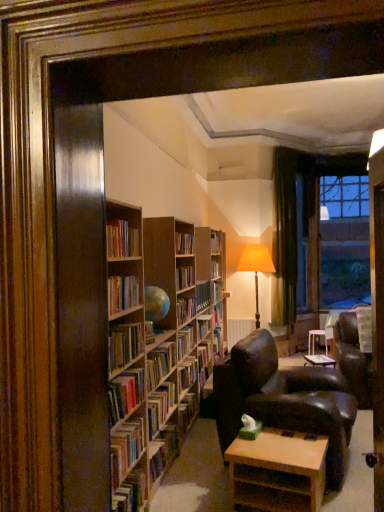
Image resolution: width=384 pixels, height=512 pixels. I want to click on hardcover books at center, the second book ordered from the bottom, so click(160, 406).

The height and width of the screenshot is (512, 384). In order to click on wooden bookshelf at center, placed as the 4th book when sorted from bottom to top in this screenshot , I will do `click(122, 293)`.

You are a GUI agent. You are given a task and a screenshot of the screen. Output one action in this format:
    pyautogui.click(x=<x>, y=<y>)
    Task: Click on the hardcover books at center, the third book positioned from the bottom
    This screenshot has width=384, height=512.
    Given the screenshot: What is the action you would take?
    pyautogui.click(x=160, y=362)

Locate an element on the screen. wooden bookcase at left is located at coordinates (155, 347).

Find the location of a particular element. The height and width of the screenshot is (512, 384). transparent glass door at upper right is located at coordinates pyautogui.click(x=305, y=239).

Based on the photo, from the image's perspective, does transparent glass door at upper right appear higher than clear glass window at upper right?

No, from the image's perspective, transparent glass door at upper right is not above clear glass window at upper right.

From a real-world perspective, is transparent glass door at upper right over clear glass window at upper right?

Actually, transparent glass door at upper right is physically below clear glass window at upper right in the real world.

Considering the positions of objects transparent glass door at upper right and clear glass window at upper right in the image provided, who is more to the left, transparent glass door at upper right or clear glass window at upper right?

transparent glass door at upper right.

Is point (259, 339) closer or farther from the camera than point (180, 252)?

Point (259, 339) is farther from the camera than point (180, 252).

Considering the relative sizes of leather armchair at center and wooden bookcase at left in the image provided, is leather armchair at center wider than wooden bookcase at left?

Yes.

From the image's perspective, which is above, leather armchair at center or wooden bookcase at left?

wooden bookcase at left, from the image's perspective.

Is leather armchair at center not close to wooden bookcase at left?

No, leather armchair at center is not far away from wooden bookcase at left.

Is matte orange shade at center located outside transparent glass door at upper right?

Yes.

Is matte orange shade at center bigger than transparent glass door at upper right?

Yes, matte orange shade at center is bigger than transparent glass door at upper right.

Which point is more forward, (250, 245) or (312, 302)?

Positioned in front is point (312, 302).

From the image's perspective, is matte orange shade at center below transparent glass door at upper right?

Yes, from the image's perspective, matte orange shade at center is below transparent glass door at upper right.

Is point (274, 482) behind point (135, 279)?

Yes, point (274, 482) is behind point (135, 279).

Is light brown wooden table at lower center oriented away from wooden bookshelf at center, placed as the 4th book when sorted from bottom to top?

No, light brown wooden table at lower center's orientation is not away from wooden bookshelf at center, placed as the 4th book when sorted from bottom to top.

Considering the sizes of objects light brown wooden table at lower center and wooden bookshelf at center, placed as the 4th book when sorted from bottom to top, in the image provided, who is thinner, light brown wooden table at lower center or wooden bookshelf at center, placed as the 4th book when sorted from bottom to top,?

With smaller width is wooden bookshelf at center, placed as the 4th book when sorted from bottom to top.

Does matte orange shade at center touch wooden bookcase at left?

No, matte orange shade at center is not with wooden bookcase at left.

Is matte orange shade at center facing towards wooden bookcase at left?

No, matte orange shade at center does not turn towards wooden bookcase at left.

Is matte orange shade at center to the left of wooden bookcase at left from the viewer's perspective?

No.

Is light brown wooden table at lower center closer to the viewer compared to wooden bookcase at left?

No, light brown wooden table at lower center is behind wooden bookcase at left.

Considering the positions of point (309, 490) and point (149, 340), is point (309, 490) closer or farther from the camera than point (149, 340)?

Point (309, 490) is closer to the camera than point (149, 340).

Would you say light brown wooden table at lower center is a long distance from wooden bookcase at left?

That's not correct — light brown wooden table at lower center is a little close to wooden bookcase at left.

Choose the correct answer: Is light brown wooden table at lower center inside wooden bookcase at left or outside it?

light brown wooden table at lower center is outside wooden bookcase at left.

Does hardcover books at center, the third book positioned from the bottom, have a smaller size compared to leather armchair at center?

Indeed, hardcover books at center, the third book positioned from the bottom, has a smaller size compared to leather armchair at center.

You are a GUI agent. You are given a task and a screenshot of the screen. Output one action in this format:
    pyautogui.click(x=<x>, y=<y>)
    Task: Click on the 2nd book above the leather armchair at center (from the image's perspective)
    Image resolution: width=384 pixels, height=512 pixels.
    Given the screenshot: What is the action you would take?
    pyautogui.click(x=160, y=362)

Which of these two, hardcover books at center, positioned as the 3th book in top-to-bottom order, or leather armchair at center, is wider?

With larger width is leather armchair at center.

From the image's perspective, is hardcover books at center, positioned as the 3th book in top-to-bottom order, located above or below leather armchair at center?

From the image's perspective, hardcover books at center, positioned as the 3th book in top-to-bottom order, appears above leather armchair at center.

Image resolution: width=384 pixels, height=512 pixels. What are the coordinates of `glass door below the clear glass window at upper right (from the image's perspective)` in the screenshot? It's located at (305, 239).

Image resolution: width=384 pixels, height=512 pixels. I want to click on bookcase that appears on the left of leather armchair at center, so click(x=155, y=347).

From the image, which object appears to be nearer to hardcover books at center, the second book ordered from the bottom, transparent glass door at upper right or hardcover books at left, which ranks as the fifth book in bottom-to-top order?

hardcover books at left, which ranks as the fifth book in bottom-to-top order, is positioned closer to the anchor hardcover books at center, the second book ordered from the bottom.

Considering their positions, is light brown wooden table at lower center positioned closer to hardcover books at center, the third book positioned from the bottom, than transparent glass door at upper right?

light brown wooden table at lower center.

Which object lies nearer to the anchor point hardcover books at center, acting as the fourth book starting from the top, leather armchair at center or clear glass window at upper right?

Among the two, leather armchair at center is located nearer to hardcover books at center, acting as the fourth book starting from the top.

Based on their spatial positions, is matte orange shade at center or wooden bookcase at left further from transparent glass door at upper right?

Based on the image, wooden bookcase at left appears to be further to transparent glass door at upper right.

When comparing their distances from transparent glass door at upper right, does leather armchair at center or hardcover book at lower left, placed as the 1th book when sorted from bottom to top, seem further?

hardcover book at lower left, placed as the 1th book when sorted from bottom to top, is further to transparent glass door at upper right.

Estimate the real-world distances between objects in this image. Which object is closer to wooden bookshelf at center, the 2th book viewed from the top, hardcover books at center, the second book ordered from the bottom, or hardcover books at left, which ranks as the fifth book in bottom-to-top order?

hardcover books at left, which ranks as the fifth book in bottom-to-top order, is positioned closer to the anchor wooden bookshelf at center, the 2th book viewed from the top.

Based on their spatial positions, is leather armchair at center or wooden bookshelf at center, placed as the 4th book when sorted from bottom to top, closer to matte orange shade at center?

leather armchair at center lies closer to matte orange shade at center than the other object.

When comparing their distances from wooden bookcase at left, does transparent glass door at upper right or hardcover book at lower left, placed as the 1th book when sorted from bottom to top, seem further?

transparent glass door at upper right lies further to wooden bookcase at left than the other object.

The width and height of the screenshot is (384, 512). Find the location of `table lamp between hardcover books at center, the second book ordered from the bottom, and clear glass window at upper right, along the z-axis`. table lamp between hardcover books at center, the second book ordered from the bottom, and clear glass window at upper right, along the z-axis is located at coordinates (256, 268).

Locate an element on the screen. Image resolution: width=384 pixels, height=512 pixels. table between wooden bookcase at left and transparent glass door at upper right from front to back is located at coordinates (278, 471).

Locate an element on the screen. table between wooden bookshelf at center, the 2th book viewed from the top, and green velvet curtain at right, along the z-axis is located at coordinates (278, 471).

The width and height of the screenshot is (384, 512). Find the location of `glass door positioned between hardcover books at left, the 1th book in the top-to-bottom sequence, and clear glass window at upper right from near to far`. glass door positioned between hardcover books at left, the 1th book in the top-to-bottom sequence, and clear glass window at upper right from near to far is located at coordinates (305, 239).